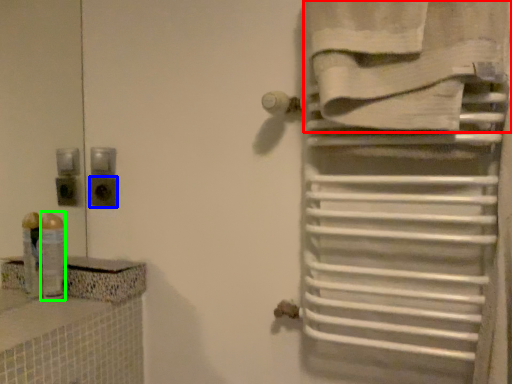
Question: Which object is positioned farthest from towel (highlighted by a red box)? Select from electric outlet (highlighted by a blue box) and toiletry (highlighted by a green box).

Choices:
 (A) electric outlet
 (B) toiletry

Answer: (B)